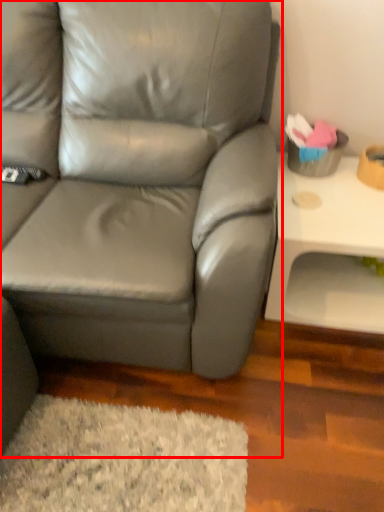
Question: From the image's perspective, where is studio couch (annotated by the red box) located in relation to table in the image?

Choices:
 (A) below
 (B) above

Answer: (B)